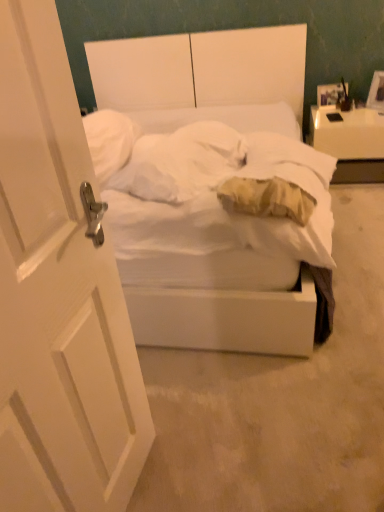
Describe the element at coordinates (350, 142) in the screenshot. I see `white glossy nightstand at upper right` at that location.

Measure the distance between point (x=137, y=71) and camera.

Point (x=137, y=71) is 3.29 meters away from camera.

The image size is (384, 512). What do you see at coordinates (204, 77) in the screenshot?
I see `white matte bed at center` at bounding box center [204, 77].

This screenshot has height=512, width=384. In order to click on soft yellow pillow at center in this screenshot , I will do `click(181, 162)`.

In order to click on wooden photo frame at upper right in this screenshot , I will do `click(331, 93)`.

Which is in front, point (203, 165) or point (5, 7)?

The point (5, 7) is closer to the camera.

From a real-world perspective, which is physically below, soft yellow pillow at center or white matte door at left?

soft yellow pillow at center, from a real-world perspective.

This screenshot has height=512, width=384. I want to click on door located below the soft yellow pillow at center (from the image's perspective), so click(x=58, y=295).

From the picture: Does soft yellow pillow at center appear on the left side of white matte door at left?

Incorrect, soft yellow pillow at center is not on the left side of white matte door at left.

Between point (174, 323) and point (337, 116), which one is positioned in front?

The point (174, 323) is closer.

Is white matte bed at center facing away from white glossy nightstand at upper right?

No, white matte bed at center's orientation is not away from white glossy nightstand at upper right.

Considering the sizes of white matte bed at center and white glossy nightstand at upper right in the image, is white matte bed at center taller or shorter than white glossy nightstand at upper right?

Considering their sizes, white matte bed at center has more height than white glossy nightstand at upper right.

Which is farther from the camera, (342, 85) or (237, 136)?

Point (342, 85)

Which object is wider, wooden photo frame at upper right or soft yellow pillow at center?

Wider between the two is soft yellow pillow at center.

Who is taller, wooden photo frame at upper right or soft yellow pillow at center?

With more height is wooden photo frame at upper right.

Would you say white glossy nightstand at upper right is a long distance from wooden photo frame at upper right?

white glossy nightstand at upper right is actually quite close to wooden photo frame at upper right.

Consider the image. Who is shorter, white glossy nightstand at upper right or wooden photo frame at upper right?

wooden photo frame at upper right.

Is white glossy nightstand at upper right not within wooden photo frame at upper right?

Yes, white glossy nightstand at upper right is located beyond the bounds of wooden photo frame at upper right.

Looking at this image, are soft yellow pillow at center and wooden photo frame at upper right located far from each other?

Yes, soft yellow pillow at center and wooden photo frame at upper right are located far from each other.

How much distance is there between soft yellow pillow at center and wooden photo frame at upper right?

5.45 feet.

Which object is positioned more to the left, soft yellow pillow at center or wooden photo frame at upper right?

soft yellow pillow at center is more to the left.

From the picture: Is soft yellow pillow at center oriented towards wooden photo frame at upper right?

No, soft yellow pillow at center does not turn towards wooden photo frame at upper right.

Is white matte bed at center located outside white matte door at left?

white matte bed at center lies outside white matte door at left's area.

From a real-world perspective, does white matte bed at center stand above white matte door at left?

No, from a real-world perspective, white matte bed at center is not on top of white matte door at left.

Where is `bed behind the white matte door at left`? bed behind the white matte door at left is located at coordinates (204, 77).

Are white matte bed at center and white matte door at left located far from each other?

white matte bed at center is far away from white matte door at left.

Does white glossy nightstand at upper right have a greater width compared to white matte door at left?

Indeed, white glossy nightstand at upper right has a greater width compared to white matte door at left.

Are white glossy nightstand at upper right and white matte door at left far apart?

Yes, white glossy nightstand at upper right and white matte door at left are quite far apart.

Between white glossy nightstand at upper right and white matte door at left, which one appears on the left side from the viewer's perspective?

white matte door at left.

The image size is (384, 512). In order to click on pillow that is under the white matte door at left (from a real-world perspective) in this screenshot , I will do (x=181, y=162).

Locate an element on the screen. This screenshot has width=384, height=512. bed on the left of white glossy nightstand at upper right is located at coordinates (204, 77).

Which object lies further to the anchor point white glossy nightstand at upper right, soft yellow pillow at center or white matte door at left?

white matte door at left.

Estimate the real-world distances between objects in this image. Which object is further from white glossy nightstand at upper right, white matte door at left or wooden photo frame at upper right?

Based on the image, white matte door at left appears to be further to white glossy nightstand at upper right.

Based on their spatial positions, is white glossy nightstand at upper right or soft yellow pillow at center closer to white matte bed at center?

white glossy nightstand at upper right lies closer to white matte bed at center than the other object.

Considering their positions, is soft yellow pillow at center positioned further to white matte door at left than white matte bed at center?

white matte bed at center is further to white matte door at left.

When comparing their distances from soft yellow pillow at center, does white matte bed at center or white matte door at left seem further?

The object further to soft yellow pillow at center is white matte bed at center.

Which object lies further to the anchor point white matte bed at center, soft yellow pillow at center or white glossy nightstand at upper right?

soft yellow pillow at center is positioned further to the anchor white matte bed at center.

Considering their positions, is wooden photo frame at upper right positioned further to white glossy nightstand at upper right than white matte door at left?

The object further to white glossy nightstand at upper right is white matte door at left.

From the image, which object appears to be farther from white matte bed at center, white glossy nightstand at upper right or wooden photo frame at upper right?

The object further to white matte bed at center is wooden photo frame at upper right.

In order to click on pillow between white matte bed at center and wooden photo frame at upper right along the z-axis in this screenshot , I will do `click(181, 162)`.

The image size is (384, 512). I want to click on pillow between white matte door at left and wooden photo frame at upper right from front to back, so click(181, 162).

Find the location of `pillow between white matte door at left and white glossy nightstand at upper right in the front-back direction`. pillow between white matte door at left and white glossy nightstand at upper right in the front-back direction is located at coordinates (181, 162).

Where is `nightstand positioned between soft yellow pillow at center and wooden photo frame at upper right from near to far`? Image resolution: width=384 pixels, height=512 pixels. nightstand positioned between soft yellow pillow at center and wooden photo frame at upper right from near to far is located at coordinates (350, 142).